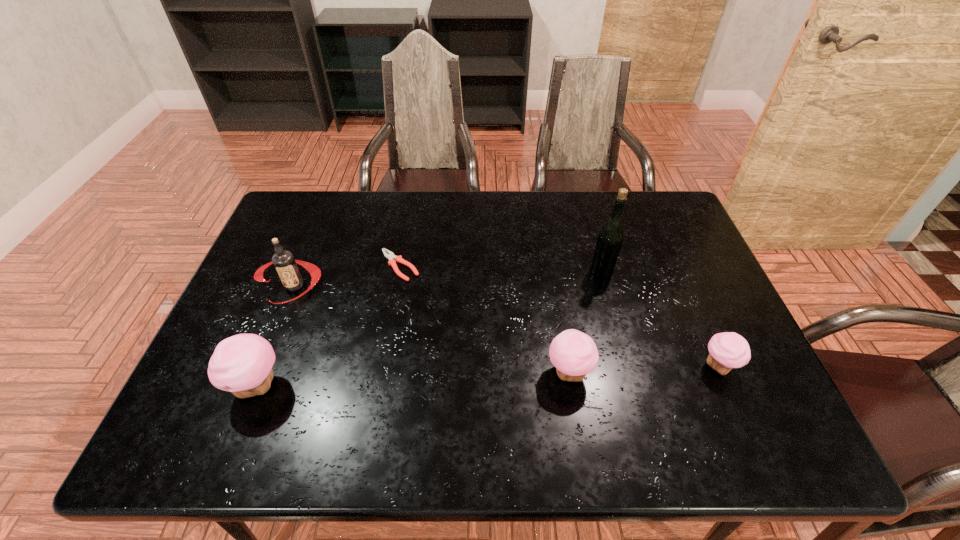
Locate an element on the screen. The image size is (960, 540). vacant space that is in between the second cupcake from left to right and the rightmost cupcake is located at coordinates pyautogui.click(x=643, y=369).

Find the location of a particular element. The height and width of the screenshot is (540, 960). vacant space that is in between the root beer and the second object from right to left is located at coordinates 447,279.

Where is `vacant area that lies between the fourth tallest object and the tallest object`? vacant area that lies between the fourth tallest object and the tallest object is located at coordinates (585, 322).

Find the location of a particular element. This screenshot has width=960, height=540. vacant region between the tallest object and the fourth object from right to left is located at coordinates (500, 269).

Locate an element on the screen. This screenshot has height=540, width=960. vacant space that is in between the fourth tallest object and the shortest object is located at coordinates tap(484, 319).

Where is `free space between the tallest cupcake and the fifth tallest object`? The image size is (960, 540). free space between the tallest cupcake and the fifth tallest object is located at coordinates pos(489,376).

This screenshot has height=540, width=960. What are the coordinates of `object that stands as the third closest to the tallest cupcake` in the screenshot? It's located at (574, 354).

Locate which object ranks third in proximity to the leftmost cupcake. Please provide its 2D coordinates. Your answer should be formatted as a tuple, i.e. [(x, y)], where the tuple contains the x and y coordinates of a point satisfying the conditions above.

[(574, 354)]

This screenshot has width=960, height=540. Find the location of `cupcake that is the closest to the rightmost object`. cupcake that is the closest to the rightmost object is located at coordinates (574, 354).

This screenshot has height=540, width=960. I want to click on the second closest cupcake to the leftmost cupcake, so click(728, 350).